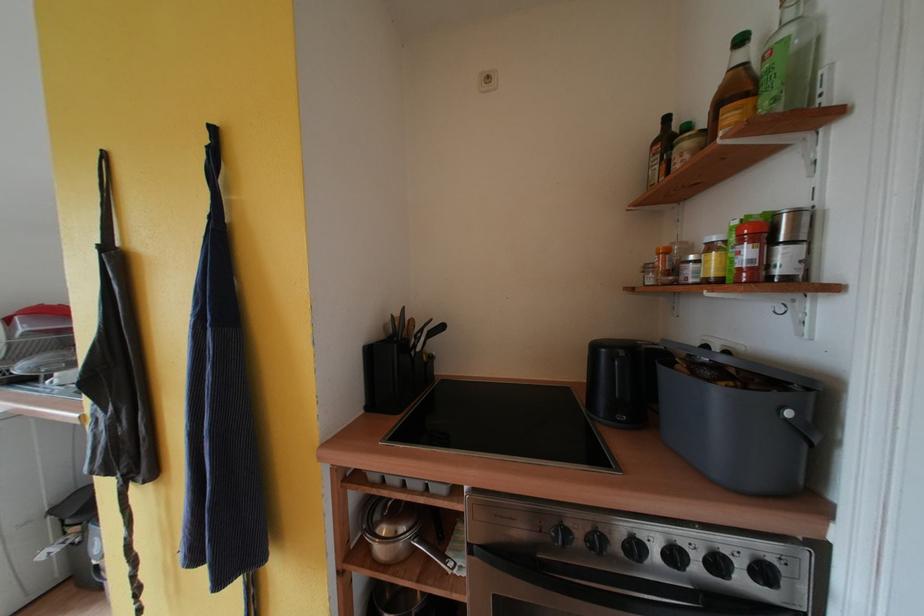
Where would you grasp the saucepan handle? Please return your answer as a coordinate pair (x, y).

(398, 533)